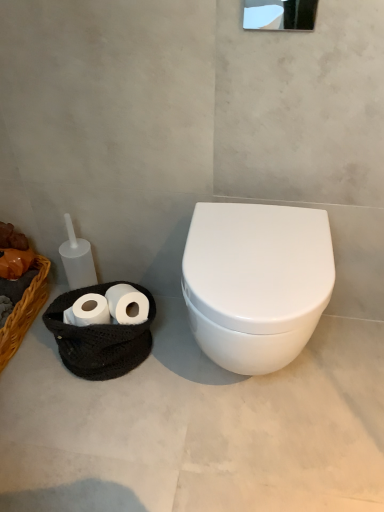
Question: In terms of width, does white matte toilet paper at lower left look wider or thinner when compared to white glossy mirror at upper center?

Choices:
 (A) wide
 (B) thin

Answer: (A)

Question: Is white matte toilet paper at lower left inside or outside of white glossy mirror at upper center?

Choices:
 (A) outside
 (B) inside

Answer: (A)

Question: Estimate the real-world distances between objects in this image. Which object is farther from the white glossy toilet at center?

Choices:
 (A) braided wicker basket at left
 (B) white glossy toilet at right
 (C) white glossy mirror at upper center
 (D) white matte toilet paper at lower left

Answer: (A)

Question: Which object is the closest to the white matte toilet paper at lower left?

Choices:
 (A) white glossy toilet at center
 (B) white glossy toilet at right
 (C) white glossy mirror at upper center
 (D) braided wicker basket at left

Answer: (B)